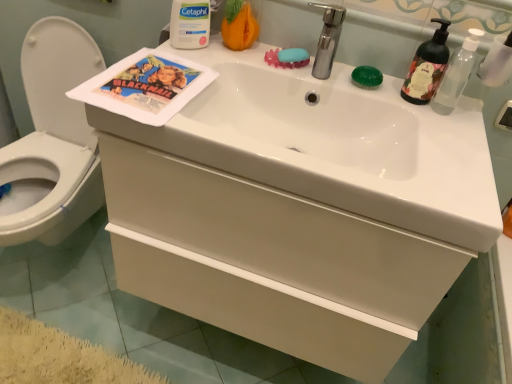
This screenshot has width=512, height=384. Find the location of `free space on the front side of green matte soap at upper right, the 1th soap in the right-to-left sequence`. free space on the front side of green matte soap at upper right, the 1th soap in the right-to-left sequence is located at coordinates (395, 105).